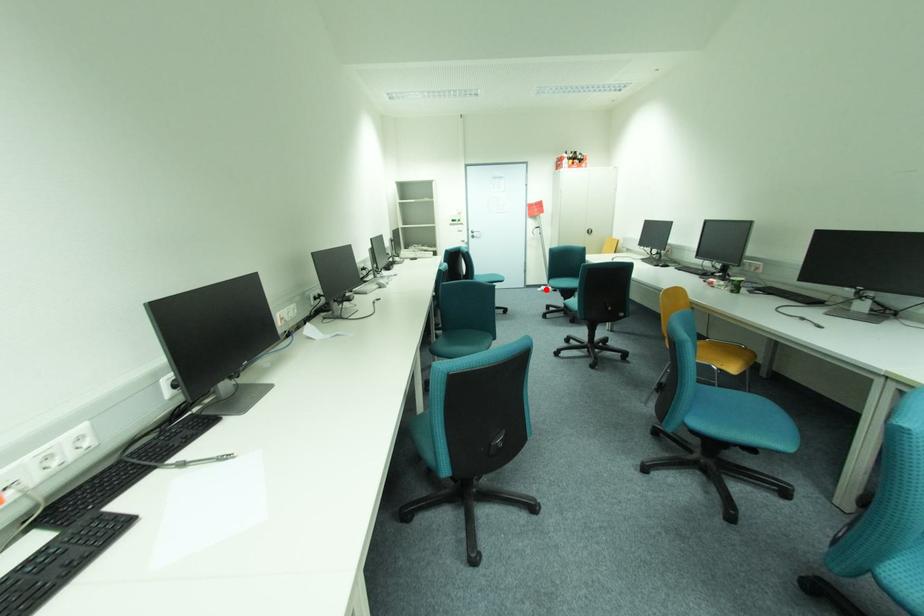
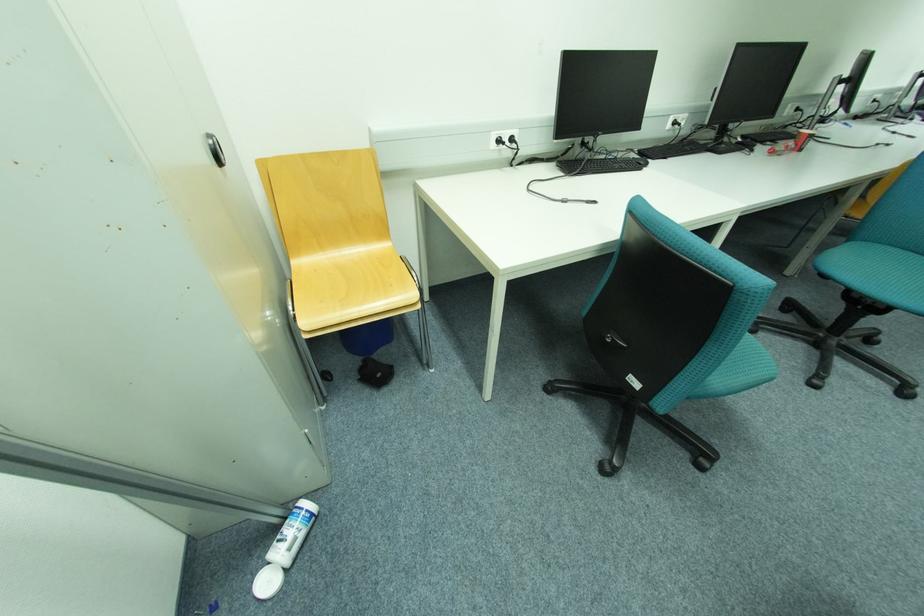
Find the pixel in the second image that matches the highlighted location in the first image.

(274, 584)